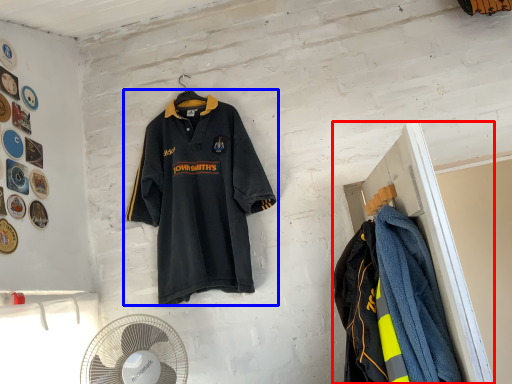
Question: Which object appears closest to the camera in this image, closet (highlighted by a red box) or sports uniform (highlighted by a blue box)?

Choices:
 (A) closet
 (B) sports uniform

Answer: (A)